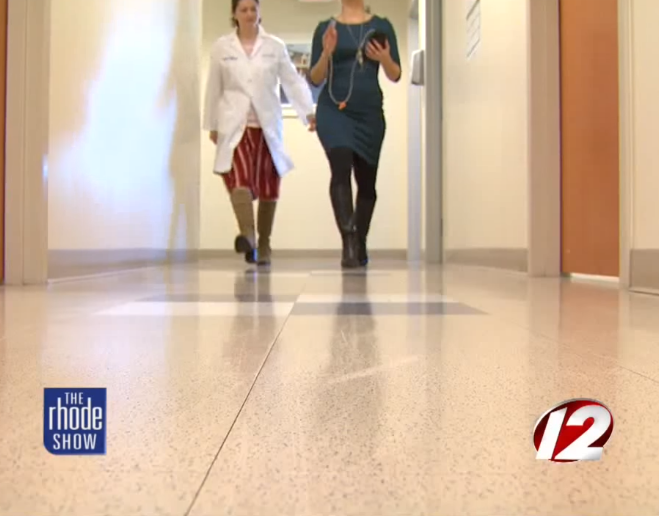
Identify the location of checkered design in floor. The width and height of the screenshot is (659, 516). (312, 305).